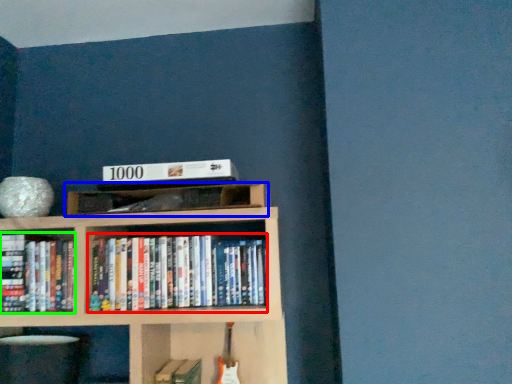
Question: Considering the real-world distances, which object is farthest from book (highlighted by a red box)? shelf (highlighted by a blue box) or book (highlighted by a green box)?

Choices:
 (A) shelf
 (B) book

Answer: (B)